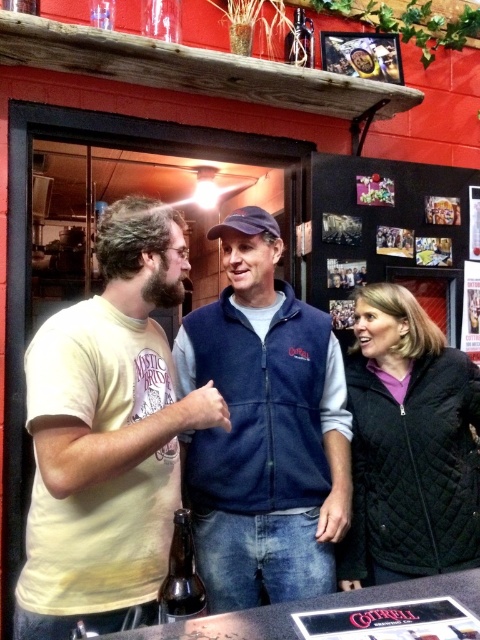
Is navy fleece vest at center wider than brown glass bottle at center?

Correct, the width of navy fleece vest at center exceeds that of brown glass bottle at center.

Is navy fleece vest at center shorter than brown glass bottle at center?

In fact, navy fleece vest at center may be taller than brown glass bottle at center.

This screenshot has width=480, height=640. Identify the location of navy fleece vest at center. click(264, 429).

Is yellow t-shirt at left smaller than black quilted jacket at right?

Incorrect, yellow t-shirt at left is not smaller in size than black quilted jacket at right.

Is point (131, 340) positioned in front of point (376, 346)?

That is True.

Find the location of a particular element. Image resolution: width=480 pixels, height=640 pixels. yellow t-shirt at left is located at coordinates (108, 436).

Can you confirm if yellow t-shirt at left is smaller than navy fleece vest at center?

Correct, yellow t-shirt at left occupies less space than navy fleece vest at center.

Which is behind, point (90, 582) or point (252, 554)?

Positioned behind is point (252, 554).

What are the coordinates of `yellow t-shirt at left` in the screenshot? It's located at (108, 436).